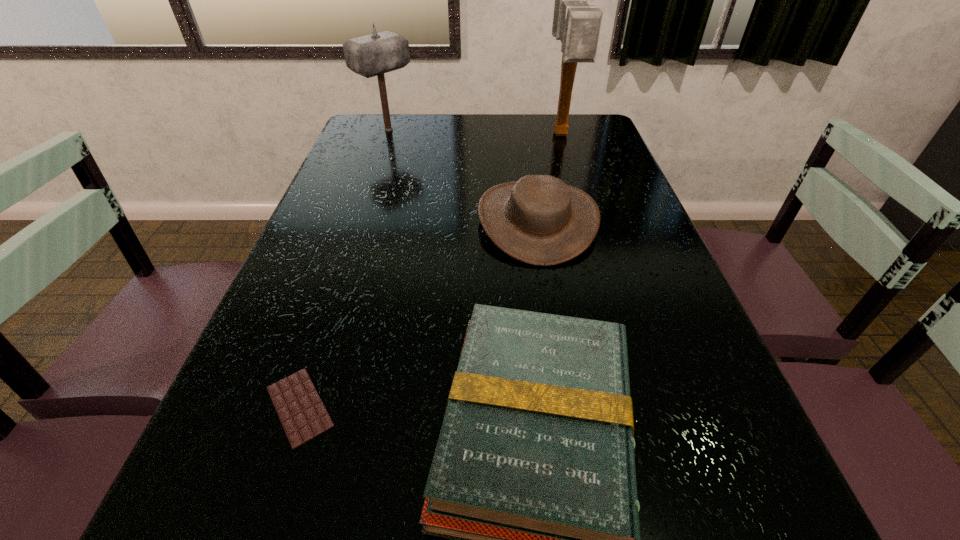
This screenshot has height=540, width=960. Identify the location of the taller mallet. (576, 24).

What are the coordinates of `the right mallet` in the screenshot? It's located at (576, 24).

Where is `the shorter mallet`? The image size is (960, 540). the shorter mallet is located at coordinates (372, 55).

Where is `the left mallet`? This screenshot has height=540, width=960. the left mallet is located at coordinates (372, 55).

Find the location of `the third farthest object`. the third farthest object is located at coordinates (540, 220).

I want to click on chocolate bar, so click(x=303, y=416).

Where is `vacant area located on the right of the tallest object`? vacant area located on the right of the tallest object is located at coordinates (603, 134).

The width and height of the screenshot is (960, 540). I want to click on vacant space located on the right of the shorter mallet, so click(440, 130).

The width and height of the screenshot is (960, 540). I want to click on vacant space situated on the front of the cowboy hat, so click(562, 372).

Where is `vacant region located 0.060m on the left of the shortest object`? The image size is (960, 540). vacant region located 0.060m on the left of the shortest object is located at coordinates (224, 407).